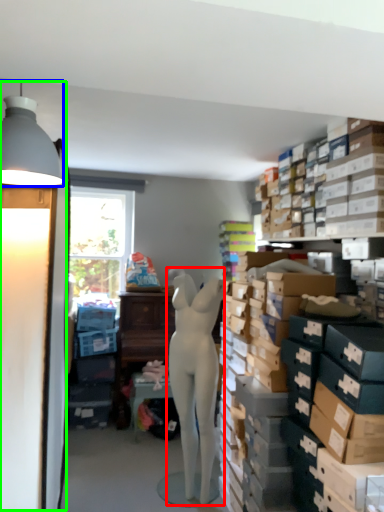
Question: Estimate the real-world distances between objects in this image. Which object is farther from person (highlighted by a red box), lamp (highlighted by a blue box) or table lamp (highlighted by a green box)?

Choices:
 (A) lamp
 (B) table lamp

Answer: (A)